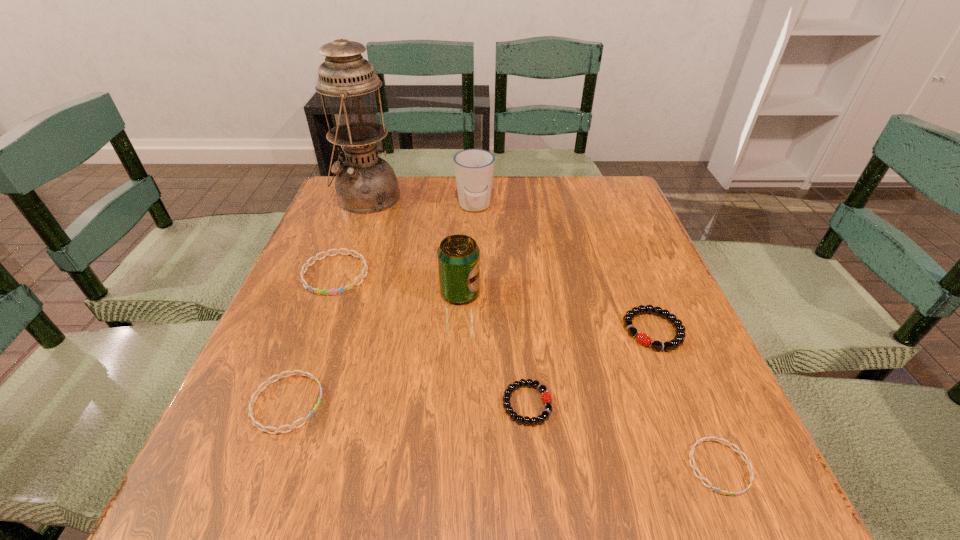
Select which bracelet is the fourth closest to the shortest bracelet. Please provide its 2D coordinates. Your answer should be formatted as a tuple, i.e. [(x, y)], where the tuple contains the x and y coordinates of a point satisfying the conditions above.

[(341, 290)]

Point out which bracelet is positioned as the fourth nearest to the second farthest blue bracelet. Please provide its 2D coordinates. Your answer should be formatted as a tuple, i.e. [(x, y)], where the tuple contains the x and y coordinates of a point satisfying the conditions above.

[(693, 466)]

Identify the location of the closest blue bracelet relative to the farthest bracelet. The height and width of the screenshot is (540, 960). (255, 423).

The width and height of the screenshot is (960, 540). In order to click on blue bracelet that stands as the second closest to the nearest bracelet in this screenshot , I will do `click(341, 290)`.

In order to click on blank area in the image that satisfies the following two spatial constraints: 1. on the surface of the biggest blue bracelet showing star-shaped elements; 2. on the right side of the fifth farthest object in this screenshot , I will do `click(314, 330)`.

Identify the location of blank space that satisfies the following two spatial constraints: 1. with a handle on the side of the white cup; 2. on the surface of the second farthest blue bracelet showing star-shaped elements. The width and height of the screenshot is (960, 540). (471, 403).

At what (x,y) coordinates should I click in order to perform the action: click on free space that satisfies the following two spatial constraints: 1. on the surface of the biggest blue bracelet showing star-shaped elements; 2. on the left side of the bigger black bracelet. Please return your answer as a coordinate pair (x, y). This screenshot has width=960, height=540. Looking at the image, I should click on point(314,330).

In order to click on free space that satisfies the following two spatial constraints: 1. on the front side of the green beer can; 2. on the surface of the second smallest blue bracelet showing star-shaped elements in this screenshot , I will do `click(455, 403)`.

Find the location of a particular element. This screenshot has height=540, width=960. vacant region that satisfies the following two spatial constraints: 1. with a handle on the side of the cup; 2. on the surface of the second nearest blue bracelet showing star-shaped elements is located at coordinates (471, 403).

You are a GUI agent. You are given a task and a screenshot of the screen. Output one action in this format:
    pyautogui.click(x=<x>, y=<y>)
    Task: Click on the free spot that satisfies the following two spatial constraints: 1. with a handle on the side of the white cup; 2. on the right side of the smaller black bracelet
    Image resolution: width=960 pixels, height=540 pixels.
    Given the screenshot: What is the action you would take?
    pyautogui.click(x=471, y=404)